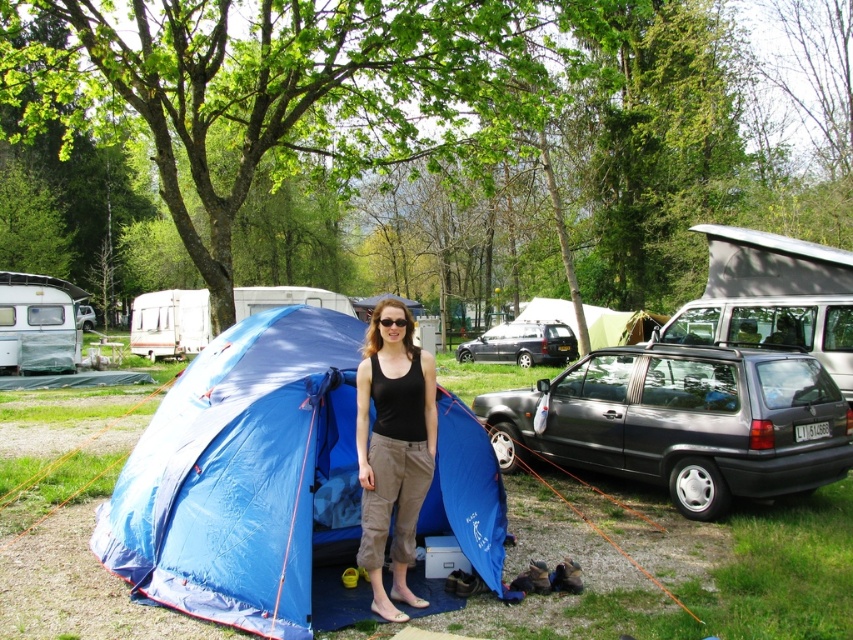
Question: Estimate the real-world distances between objects in this image. Which object is closer to the black fabric tank top at center?

Choices:
 (A) silver metallic van at center
 (B) metallic gray hatchback at center

Answer: (B)

Question: Does blue fabric tent at center lie behind silver metallic van at center?

Choices:
 (A) yes
 (B) no

Answer: (B)

Question: Is black fabric tank top at center further to camera compared to silver metallic van at center?

Choices:
 (A) no
 (B) yes

Answer: (A)

Question: Which point is farther to the camera?

Choices:
 (A) silver metallic van at center
 (B) metallic gray hatchback at center

Answer: (B)

Question: Is the position of black fabric tank top at center less distant than that of silver metallic van at center?

Choices:
 (A) no
 (B) yes

Answer: (B)

Question: Which of the following is the farthest from the observer?

Choices:
 (A) (370, 454)
 (B) (201, 433)

Answer: (B)